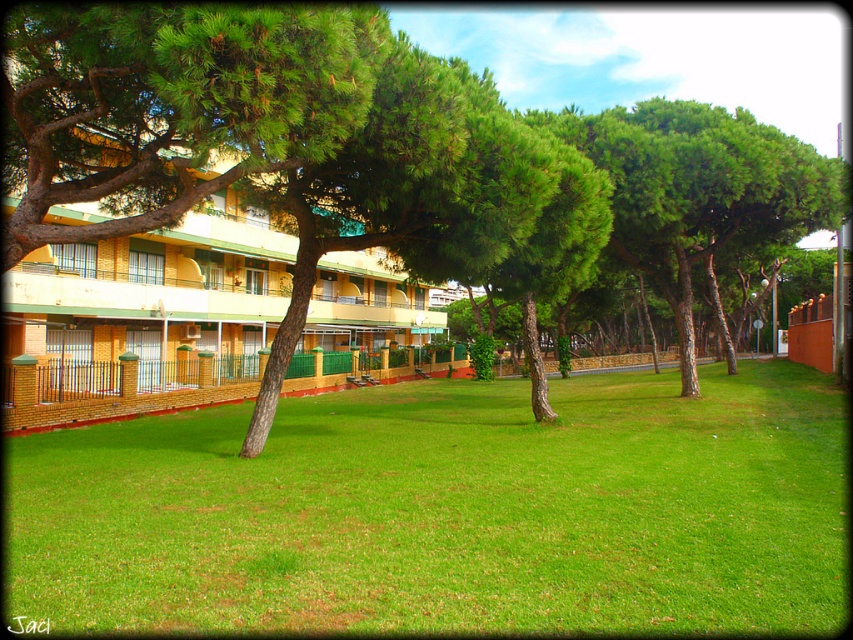
Looking at this image, you are planning to plant a new tree in the green grass at center. Considering the height of the yellow wood hotel at left, will the tree grow taller than the hotel if it reaches its maximum height?

The green grass at center has a lesser height compared to the yellow wood hotel at left. Since the grass is shorter than the hotel, the tree, if it grows to its maximum height, could potentially surpass the hotel unless restricted.

You are standing in the middle of the green grass at center and want to walk to the yellow wood hotel at left. Which direction should you head towards?

The green grass at center is to the right of the yellow wood hotel at left, so you should head towards the left to reach the yellow wood hotel at left.